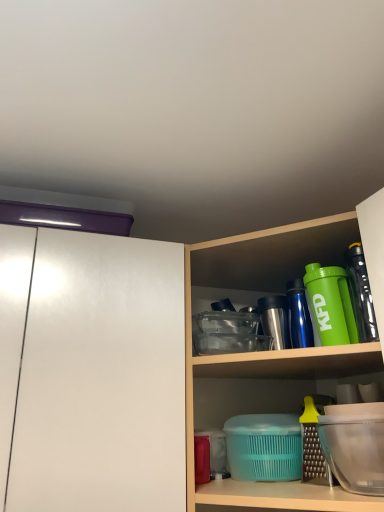
Question: Could translucent plastic containers at center be considered to be inside green matte shaker at upper right, the 2th bottle when ordered from front to back?

Choices:
 (A) yes
 (B) no

Answer: (B)

Question: Is green matte shaker at upper right, the 2th bottle when ordered from front to back, positioned with its back to translucent plastic containers at center?

Choices:
 (A) yes
 (B) no

Answer: (A)

Question: Considering the relative positions of green matte shaker at upper right, the 2th bottle when ordered from front to back, and translucent plastic containers at center in the image provided, is green matte shaker at upper right, the 2th bottle when ordered from front to back, behind translucent plastic containers at center?

Choices:
 (A) yes
 (B) no

Answer: (A)

Question: From a real-world perspective, is green matte shaker at upper right, which appears as the first bottle when viewed from the back, below translucent plastic containers at center?

Choices:
 (A) yes
 (B) no

Answer: (B)

Question: Does green matte shaker at upper right, which appears as the first bottle when viewed from the back, have a smaller size compared to translucent plastic containers at center?

Choices:
 (A) no
 (B) yes

Answer: (B)

Question: Is green matte shaker at upper right, which appears as the first bottle when viewed from the back, positioned beyond the bounds of translucent plastic containers at center?

Choices:
 (A) no
 (B) yes

Answer: (A)

Question: Is the depth of green matte shaker at upper right, which appears as the first bottle when viewed from the back, greater than that of transparent plastic container at lower right?

Choices:
 (A) yes
 (B) no

Answer: (A)

Question: Is transparent plastic container at lower right at the back of green matte shaker at upper right, which appears as the first bottle when viewed from the back?

Choices:
 (A) yes
 (B) no

Answer: (B)

Question: From the image's perspective, is green matte shaker at upper right, the 2th bottle when ordered from front to back, beneath transparent plastic container at lower right?

Choices:
 (A) yes
 (B) no

Answer: (B)

Question: Can you confirm if green matte shaker at upper right, the 2th bottle when ordered from front to back, is positioned to the right of transparent plastic container at lower right?

Choices:
 (A) yes
 (B) no

Answer: (B)

Question: Is green matte shaker at upper right, which appears as the first bottle when viewed from the back, completely or partially outside of transparent plastic container at lower right?

Choices:
 (A) no
 (B) yes

Answer: (B)

Question: Is the depth of green matte shaker at upper right, which appears as the first bottle when viewed from the back, less than that of transparent plastic container at lower right?

Choices:
 (A) yes
 (B) no

Answer: (B)

Question: From the image's perspective, is white glossy cabinet at left beneath transparent plastic container at lower right?

Choices:
 (A) yes
 (B) no

Answer: (B)